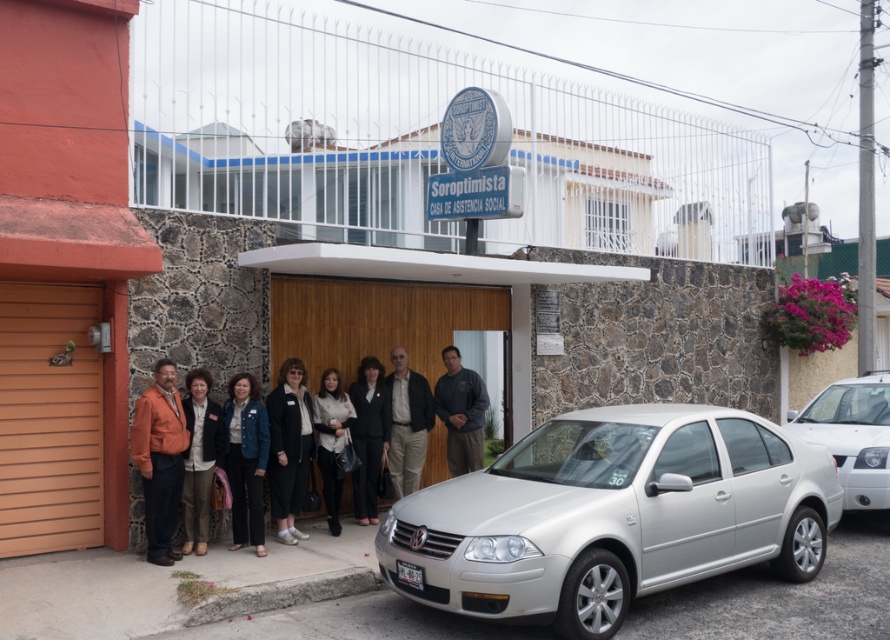
You are a photographer taking a group photo of the people in front of the Soroptimista Casa de Asistencia Social. You notice the orange fabric jacket at left and the black matte blazer at center. Which clothing item is taller?

The orange fabric jacket at left is taller than the black matte blazer at center according to the description.

You are attending an event at the Soroptimist Social Assistance House and notice a silver metallic sedan at center and a black matte blazer at center. Which object is positioned higher from the ground?

The silver metallic sedan at center is located above the black matte blazer at center, so it is positioned higher from the ground.